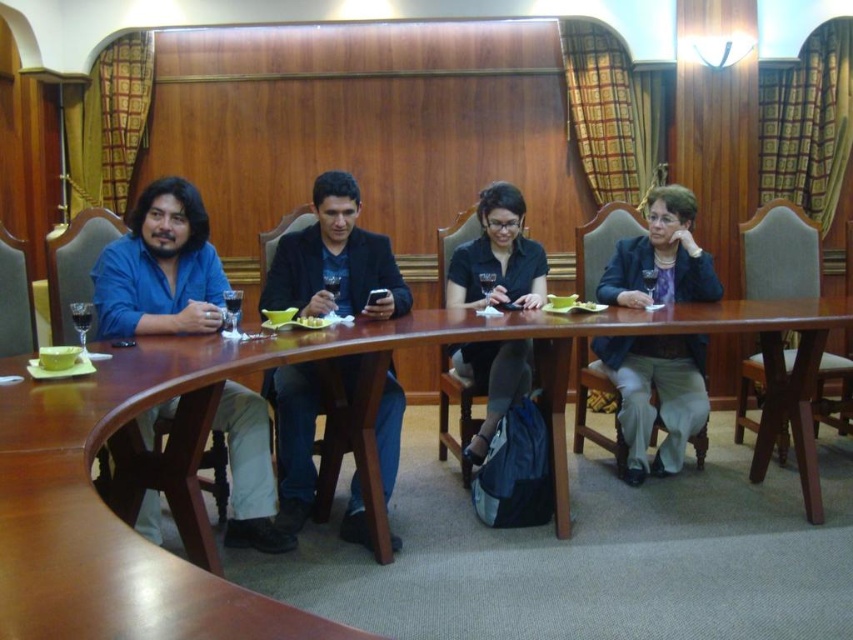
Question: Can you confirm if black matte suit at center is smaller than matte black shirt at center?

Choices:
 (A) no
 (B) yes

Answer: (A)

Question: Estimate the real-world distances between objects in this image. Which object is closer to the blue cotton shirt at left?

Choices:
 (A) matte black shirt at center
 (B) matte blue blazer at right

Answer: (A)

Question: Does blue cotton shirt at left appear under matte blue blazer at right?

Choices:
 (A) no
 (B) yes

Answer: (A)

Question: Which is nearer to the blue cotton shirt at left?

Choices:
 (A) brown wood table at center
 (B) matte black shirt at center
 (C) black matte suit at center

Answer: (C)

Question: Is brown wood table at center to the left of blue cotton shirt at left from the viewer's perspective?

Choices:
 (A) yes
 (B) no

Answer: (B)

Question: Among these objects, which one is nearest to the camera?

Choices:
 (A) blue cotton shirt at left
 (B) brown wood table at center
 (C) matte black shirt at center
 (D) black matte suit at center

Answer: (B)